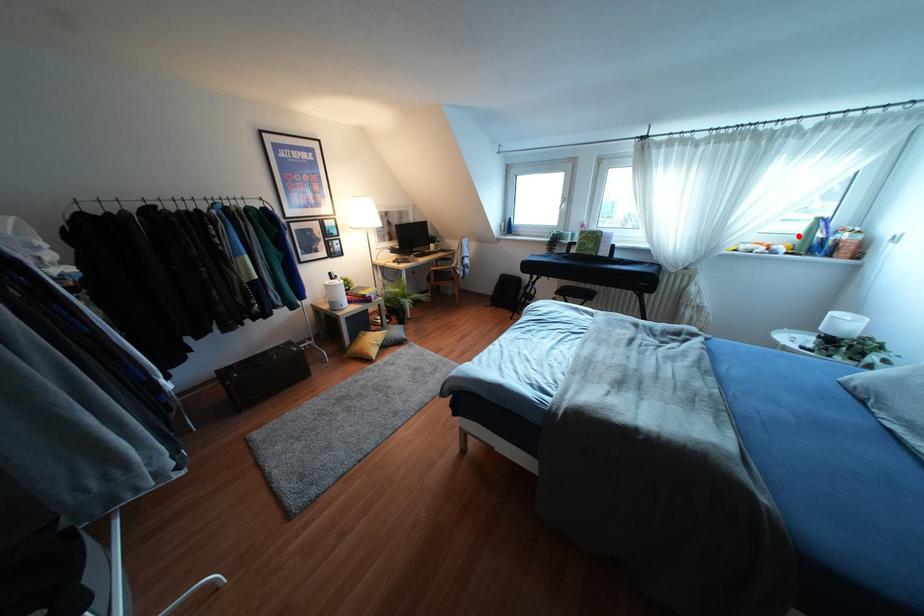
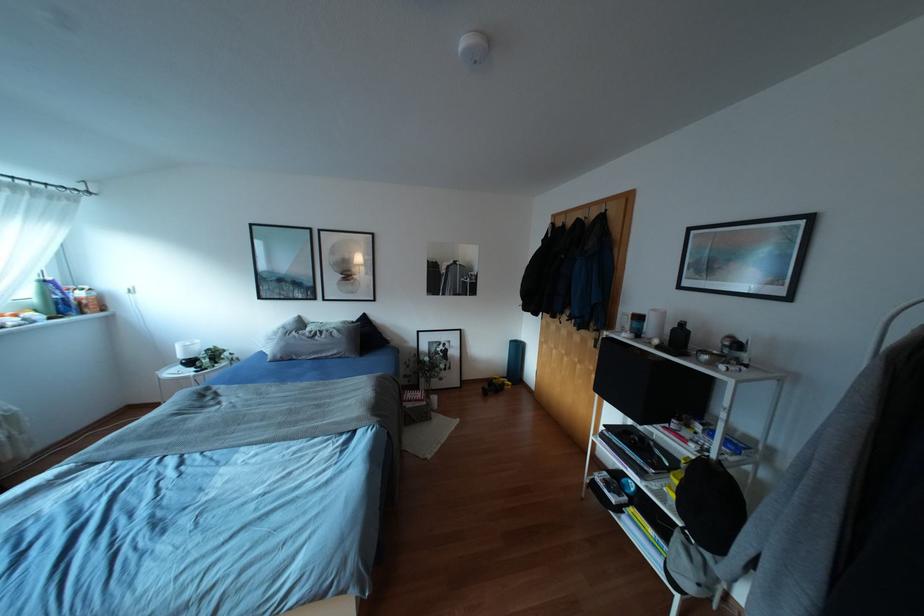
Find the pixel in the second image that matches the highlighted location in the first image.

(35, 301)